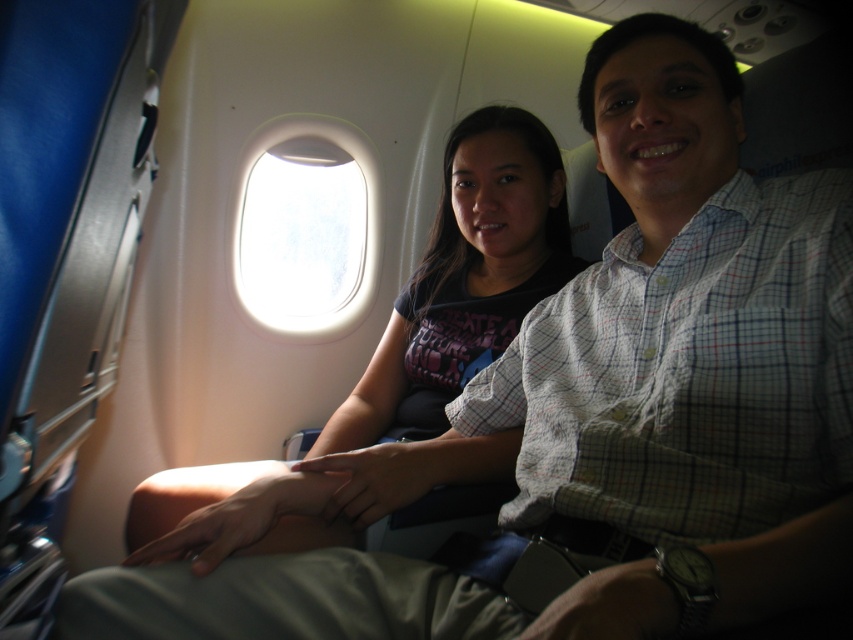
You are a flight attendant checking the cabin for safety. You notice the matte black shirt at center and the transparent glass airplane window at center. Which object is closer to you as you walk down the aisle?

The matte black shirt at center is closer to you because it is in front of the transparent glass airplane window at center.

You are a flight attendant checking seat assignments. You notice the matte black shirt at center and the transparent glass airplane window at center. Which object is closer to the floor?

The matte black shirt at center is shorter than the transparent glass airplane window at center, so the matte black shirt at center is closer to the floor.

You are a flight attendant and need to check the window seal for damage. You are standing in the aisle and see the matte black shirt at center and the transparent glass airplane window at center. Which object is closer to your current position?

The matte black shirt at center is closer to your position because it is to the right of the transparent glass airplane window at center, implying it is nearer to the aisle where you are standing.